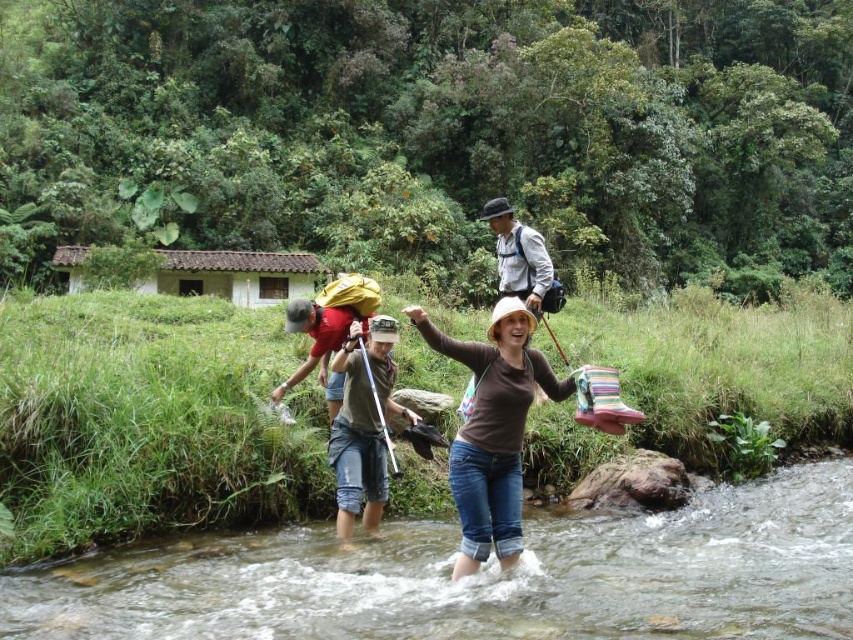
You are standing at the point labeled point (x=218, y=556) and want to walk to the point labeled point (x=334, y=422). Which direction should you face to move towards your destination?

You should face away from the viewer because point (x=218, y=556) is closer to the viewer than point (x=334, y=422).

You are one of the hikers in the group. You need to cross the stream safely. The clear water at river center and the brown matte shirt at center are in your path. Which object is located to the left of the other?

The clear water at river center is positioned on the left side of brown matte shirt at center, so the clear water at river center is to the left of the brown matte shirt at center.

You are one of the hikers in the scene. You notice the clear water at river center and the brown matte shirt at center. Which object is located below the other?

The clear water at river center is positioned under brown matte shirt at center.